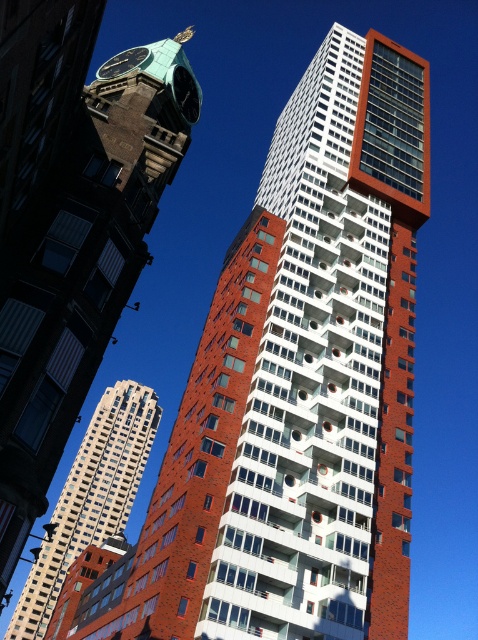
Consider the image. Between brick textured building at center and green patina clock tower at upper left, which one is positioned higher?

green patina clock tower at upper left is higher up.

Can you confirm if brick textured building at center is positioned to the right of green patina clock tower at upper left?

Indeed, brick textured building at center is positioned on the right side of green patina clock tower at upper left.

Does point (380, 376) lie in front of point (10, 536)?

That is False.

Locate an element on the screen. The width and height of the screenshot is (478, 640). brick textured building at center is located at coordinates (300, 384).

Describe the element at coordinates (300, 384) in the screenshot. I see `brick textured building at center` at that location.

Can you confirm if brick textured building at center is shorter than matte white tower at center?

No, brick textured building at center is not shorter than matte white tower at center.

The height and width of the screenshot is (640, 478). I want to click on brick textured building at center, so click(x=300, y=384).

Can you confirm if green patina clock tower at upper left is positioned above matte white tower at center?

Correct, green patina clock tower at upper left is located above matte white tower at center.

Does green patina clock tower at upper left have a greater width compared to matte white tower at center?

Yes.

Describe the element at coordinates (83, 272) in the screenshot. Image resolution: width=478 pixels, height=640 pixels. I see `green patina clock tower at upper left` at that location.

The width and height of the screenshot is (478, 640). I want to click on green patina clock tower at upper left, so click(x=83, y=272).